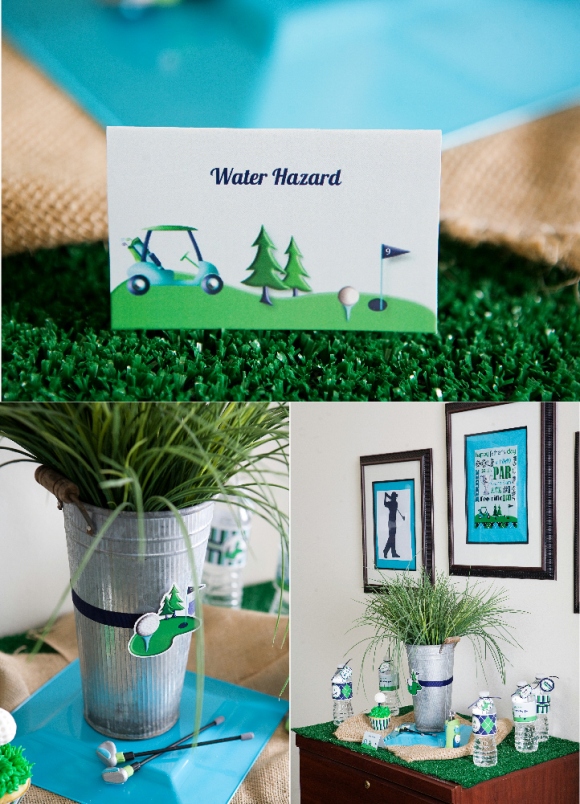
This screenshot has width=580, height=804. What are the coordinates of `wall` in the screenshot? It's located at (329, 523).